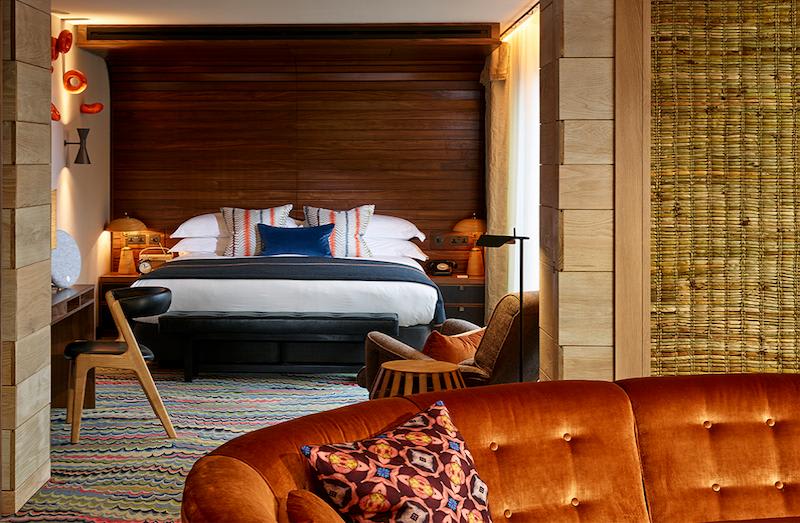
Identify the location of window. The height and width of the screenshot is (523, 800). (518, 137).